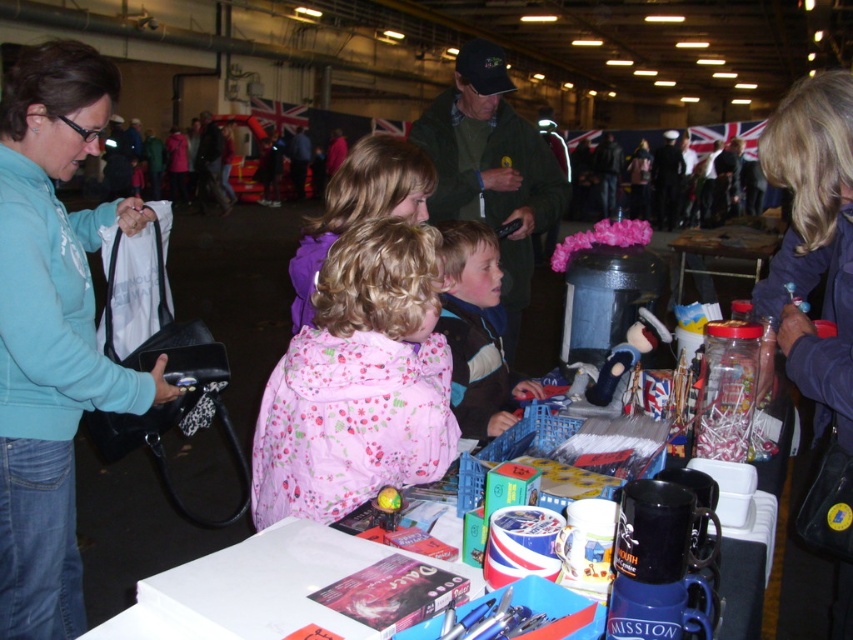
Question: Considering the real-world distances, which object is closest to the teal fabric jacket at left?

Choices:
 (A) white plastic table at center
 (B) striped fleece jacket at center

Answer: (B)

Question: Where is teal fabric jacket at left located in relation to pink floral coat at center in the image?

Choices:
 (A) below
 (B) above

Answer: (B)

Question: Which point appears farthest from the camera in this image?

Choices:
 (A) (376, 451)
 (B) (71, 264)

Answer: (B)

Question: Which point is farther to the camera?

Choices:
 (A) wooden table at center
 (B) white plastic table at center
 (C) striped fleece jacket at center

Answer: (A)

Question: Is pink floral coat at center thinner than striped fleece jacket at center?

Choices:
 (A) yes
 (B) no

Answer: (B)

Question: Where is white plastic table at center located in relation to wooden table at center in the image?

Choices:
 (A) below
 (B) above

Answer: (A)